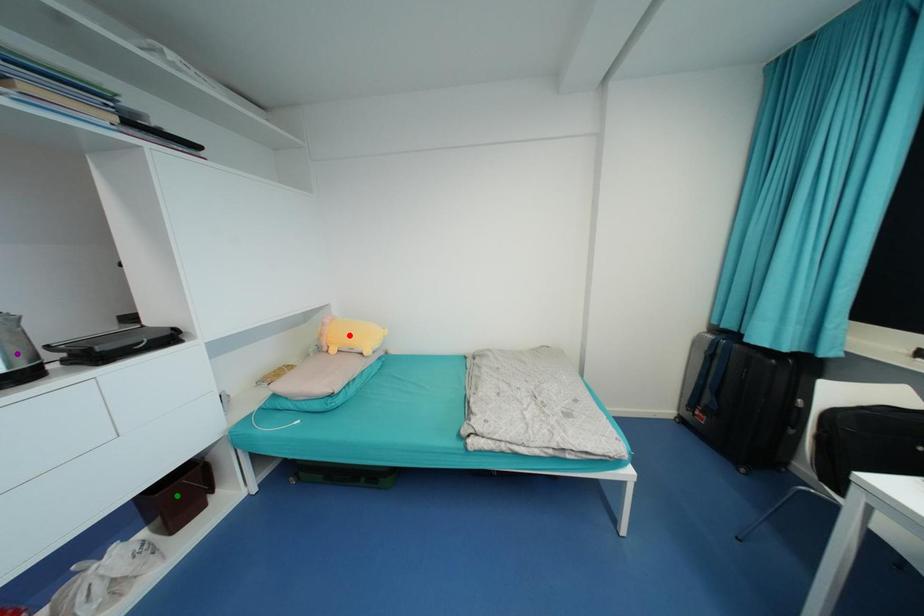
Order these from farthest to nearest:
- red point
- green point
- purple point

red point, green point, purple point